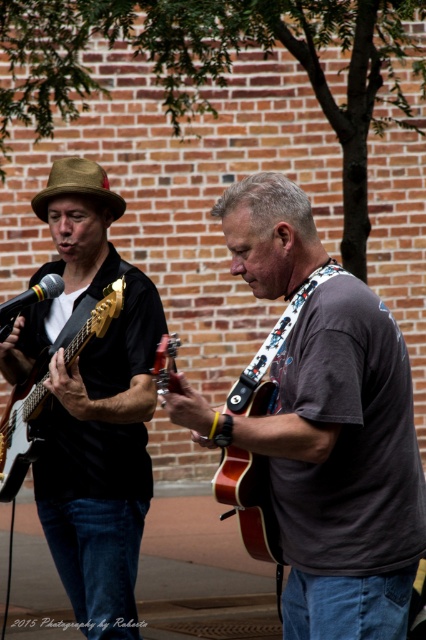
Looking at this image, measure the distance between wooden acoustic guitar at center and black matte microphone at left.

wooden acoustic guitar at center is 1.42 meters away from black matte microphone at left.

Who is positioned more to the right, wooden acoustic guitar at center or black matte microphone at left?

Positioned to the right is wooden acoustic guitar at center.

Who is more distant from viewer, (236, 387) or (19, 294)?

Positioned behind is point (19, 294).

Identify the location of wooden acoustic guitar at center. Image resolution: width=426 pixels, height=640 pixels. (249, 500).

The width and height of the screenshot is (426, 640). What do you see at coordinates (92, 403) in the screenshot?
I see `matte black guitar at left` at bounding box center [92, 403].

The image size is (426, 640). What are the coordinates of `matte black guitar at left` in the screenshot? It's located at (92, 403).

Who is more forward, (261, 189) or (8, 300)?

Point (261, 189) is more forward.

Find the location of `matte brown guitar at center`. matte brown guitar at center is located at coordinates (336, 465).